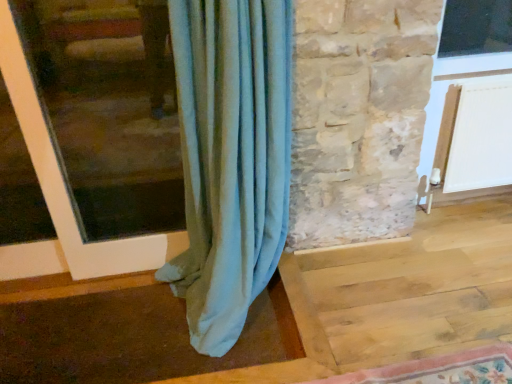
Find the location of `free space to the back side of rug with floral pattern at lower right`. free space to the back side of rug with floral pattern at lower right is located at coordinates (374, 304).